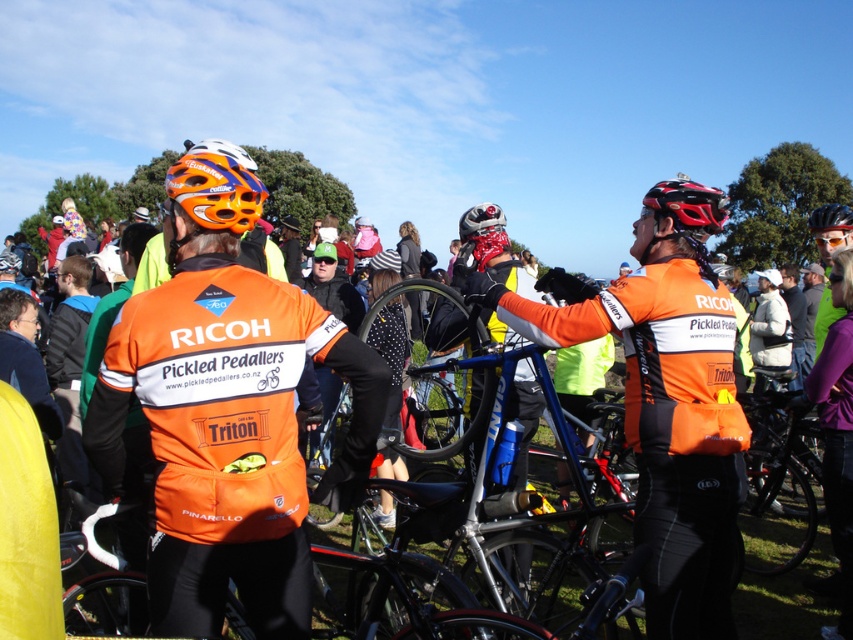
Question: Is orange jersey at center behind shiny metallic helmet at center?

Choices:
 (A) yes
 (B) no

Answer: (B)

Question: Which point is closer to the camera?

Choices:
 (A) (682, 214)
 (B) (643, 241)

Answer: (A)

Question: Does orange matte helmet at upper left have a larger size compared to matte orange goggles at center?

Choices:
 (A) yes
 (B) no

Answer: (A)

Question: In this image, where is orange jersey at center located relative to matte orange goggles at center?

Choices:
 (A) left
 (B) right

Answer: (B)

Question: Which of these objects is positioned closest to the matte orange goggles at center?

Choices:
 (A) orange jersey at center
 (B) orange matte helmet at upper center

Answer: (B)

Question: Estimate the real-world distances between objects in this image. Which object is closer to the orange matte bicycle helmet at upper left?

Choices:
 (A) shiny black helmet at center
 (B) orange jersey at center
 (C) matte orange goggles at center
 (D) orange matte helmet at upper center

Answer: (B)